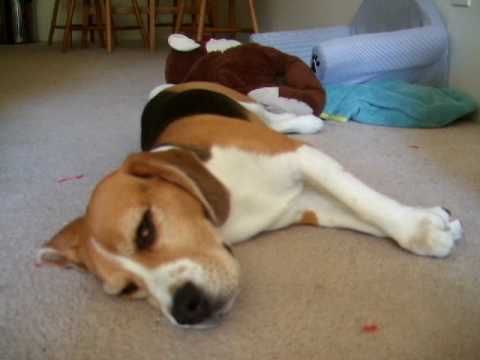
Where is `chair legs`? chair legs is located at coordinates 201,25, 256,21, 177,25, 152,30, 141,26, 109,29, 87,28, 68,31, 54,26.